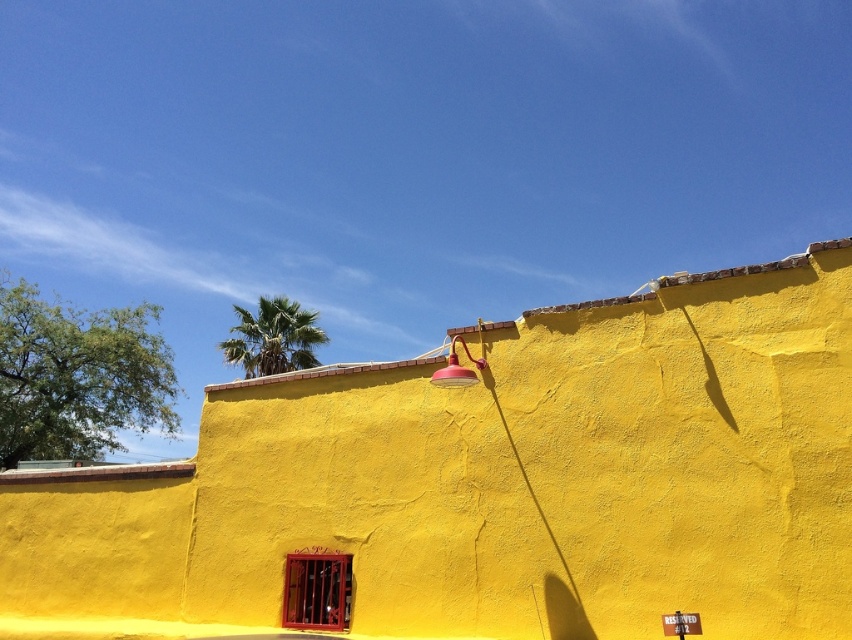
Question: Which point appears farthest from the camera in this image?

Choices:
 (A) click(x=448, y=372)
 (B) click(x=258, y=330)

Answer: (B)

Question: Is green leafy palm tree at upper center behind matte red lamp at upper center?

Choices:
 (A) no
 (B) yes

Answer: (B)

Question: Which object appears farthest from the camera in this image?

Choices:
 (A) green leafy palm tree at upper center
 (B) matte red lamp at upper center

Answer: (A)

Question: Does green leafy palm tree at upper center have a smaller size compared to matte red lamp at upper center?

Choices:
 (A) yes
 (B) no

Answer: (B)

Question: Does green leafy palm tree at upper center have a smaller size compared to matte red lamp at upper center?

Choices:
 (A) yes
 (B) no

Answer: (B)

Question: Which point appears farthest from the camera in this image?

Choices:
 (A) (242, 362)
 (B) (453, 381)

Answer: (A)